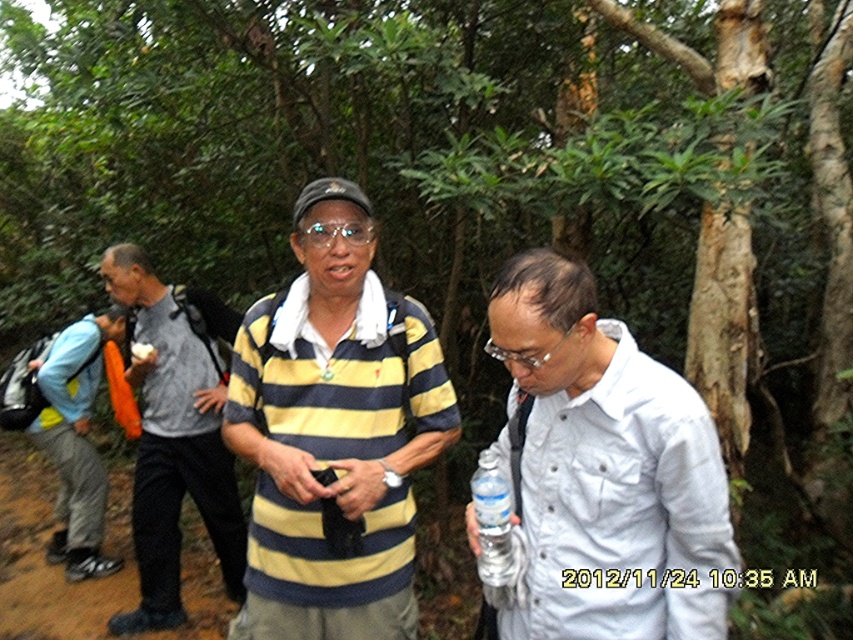
Which is behind, point (267, 435) or point (198, 483)?

The point (198, 483) is more distant.

Is point (349, 557) farther from viewer compared to point (216, 403)?

No, it is not.

Describe the element at coordinates (331, 435) in the screenshot. The height and width of the screenshot is (640, 853). I see `yellow striped shirt at center` at that location.

This screenshot has height=640, width=853. Find the location of `yellow striped shirt at center`. yellow striped shirt at center is located at coordinates (331, 435).

Does light blue fabric backpack at left have a greater height compared to clear plastic bottle at center?

Yes, light blue fabric backpack at left is taller than clear plastic bottle at center.

Can you confirm if light blue fabric backpack at left is thinner than clear plastic bottle at center?

No, light blue fabric backpack at left is not thinner than clear plastic bottle at center.

Locate an element on the screen. This screenshot has width=853, height=640. light blue fabric backpack at left is located at coordinates (76, 442).

Looking at this image, is the position of gray dotted pants at left more distant than that of clear plastic bottle at center?

That is True.

Identify the location of gray dotted pants at left. This screenshot has height=640, width=853. (175, 435).